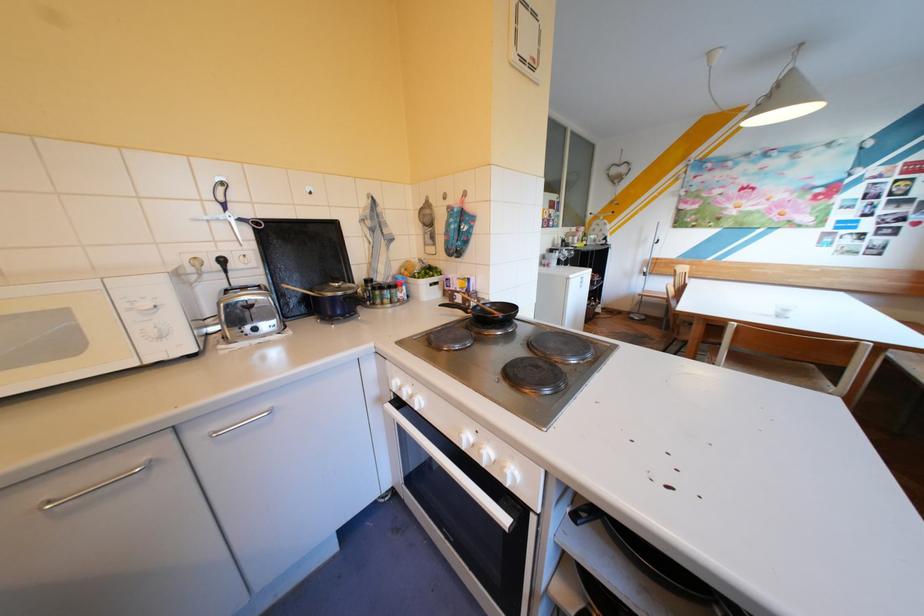
The height and width of the screenshot is (616, 924). What do you see at coordinates (407, 392) in the screenshot? I see `a white oven knob` at bounding box center [407, 392].